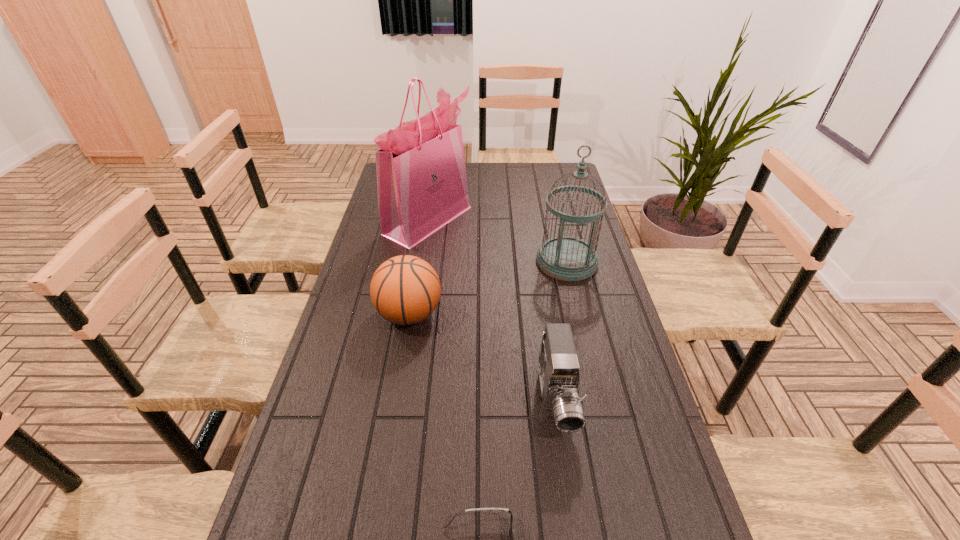
Locate an element on the screen. The width and height of the screenshot is (960, 540). object located in the right edge section of the desktop is located at coordinates (567, 258).

This screenshot has height=540, width=960. In order to click on blank space at the far edge in this screenshot , I will do `click(493, 168)`.

Locate an element on the screen. The width and height of the screenshot is (960, 540). free space at the left edge of the desktop is located at coordinates (314, 384).

What are the coordinates of `vacant space at the right edge of the desktop` in the screenshot? It's located at (588, 393).

This screenshot has width=960, height=540. Find the location of `vacant area that lies between the second tallest object and the tallest object`. vacant area that lies between the second tallest object and the tallest object is located at coordinates (497, 241).

You are a GUI agent. You are given a task and a screenshot of the screen. Output one action in this format:
    pyautogui.click(x=<x>, y=<y>)
    Task: Click on the free area in between the birdcage and the tallest object
    This screenshot has width=960, height=540.
    Given the screenshot: What is the action you would take?
    click(497, 241)

This screenshot has width=960, height=540. Identify the location of free space between the fourth shortest object and the third nearest object. (488, 287).

This screenshot has height=540, width=960. I want to click on free space between the birdcage and the third nearest object, so click(488, 287).

At what (x,y) coordinates should I click in order to perform the action: click on the fourth closest object to the second tallest object. Please return your answer as a coordinate pair (x, y). This screenshot has height=540, width=960. Looking at the image, I should click on (513, 528).

Locate an element on the screen. the fourth closest object to the camcorder is located at coordinates (421, 174).